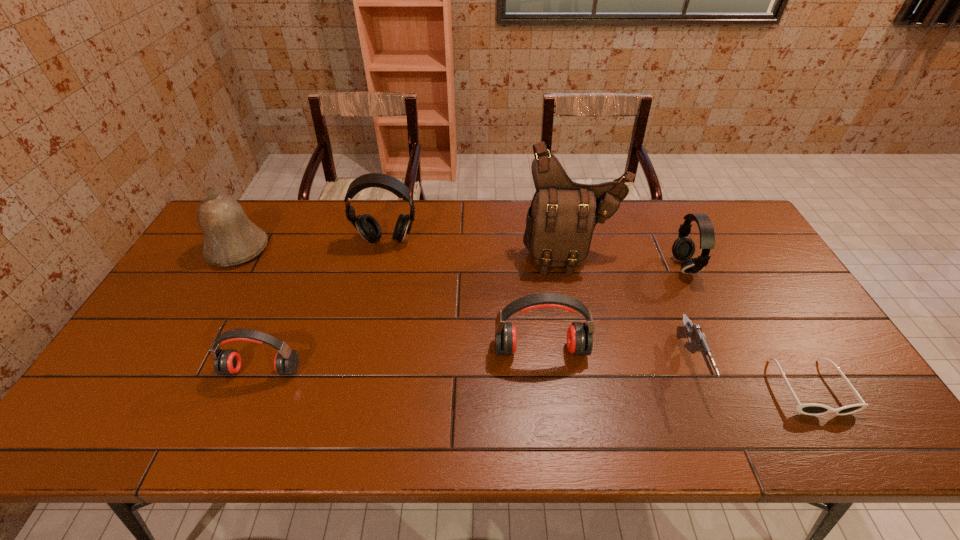
Where is `free space between the sunglasses and the left black earphone`? free space between the sunglasses and the left black earphone is located at coordinates (598, 314).

The width and height of the screenshot is (960, 540). Identify the location of free space that is in between the second earphone from left to right and the sunglasses. (598, 314).

At what (x,y) coordinates should I click in order to perform the action: click on empty location between the bigger red earphone and the black sunglasses. Please return your answer as a coordinate pair (x, y). The image size is (960, 540). Looking at the image, I should click on [x=675, y=368].

Locate an element on the screen. The width and height of the screenshot is (960, 540). vacant point located between the sixth tallest object and the second earphone from left to right is located at coordinates (324, 305).

The image size is (960, 540). Identify the location of the second closest object to the bigger red earphone. (698, 342).

Select which object is the second closest to the second object from right to left. Please provide its 2D coordinates. Your answer should be formatted as a tuple, i.e. [(x, y)], where the tuple contains the x and y coordinates of a point satisfying the conditions above.

[(698, 342)]

Identify which earphone is located as the third nearest to the third earphone from left to right. Please provide its 2D coordinates. Your answer should be formatted as a tuple, i.e. [(x, y)], where the tuple contains the x and y coordinates of a point satisfying the conditions above.

[(227, 362)]

Select which earphone appears as the second closest to the bigger black earphone. Please provide its 2D coordinates. Your answer should be formatted as a tuple, i.e. [(x, y)], where the tuple contains the x and y coordinates of a point satisfying the conditions above.

[(227, 362)]

Where is `vacant point that satisfies the following two spatial constraints: 1. on the ear cups of the smaller black earphone; 2. at the barrel of the second shortest object`? vacant point that satisfies the following two spatial constraints: 1. on the ear cups of the smaller black earphone; 2. at the barrel of the second shortest object is located at coordinates (730, 363).